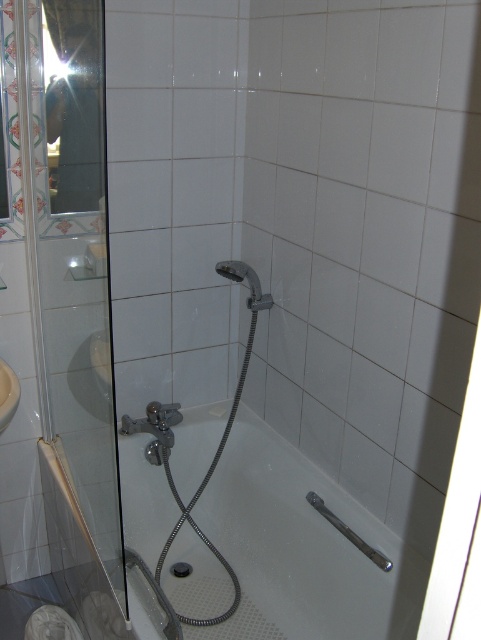
Is the position of white glossy bathtub at center less distant than that of white matte sink at lower left?

Yes.

Between white glossy bathtub at center and white matte sink at lower left, which one has more height?

Standing taller between the two is white glossy bathtub at center.

Image resolution: width=481 pixels, height=640 pixels. I want to click on white glossy bathtub at center, so click(303, 548).

Is point (80, 380) positioned behind point (358, 579)?

Yes, it is.

Does transparent glass door at left appear over white glossy bathtub at center?

Indeed, transparent glass door at left is positioned over white glossy bathtub at center.

Describe the element at coordinates (72, 301) in the screenshot. I see `transparent glass door at left` at that location.

This screenshot has width=481, height=640. Find the location of `transparent glass door at left`. transparent glass door at left is located at coordinates (72, 301).

Between transparent glass door at left and silver metallic shower head at center, which one is positioned higher?

silver metallic shower head at center is higher up.

Does transparent glass door at left come in front of silver metallic shower head at center?

Yes, transparent glass door at left is closer to the viewer.

In order to click on transparent glass door at left in this screenshot , I will do `click(72, 301)`.